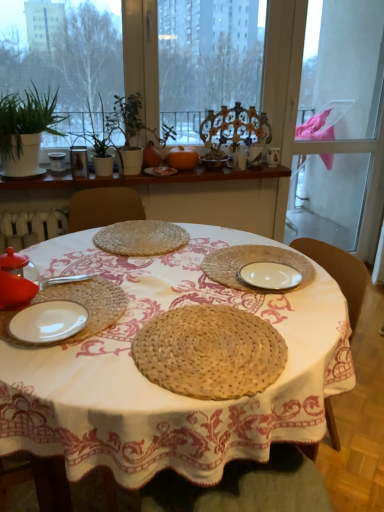
Locate an element on the screen. This screenshot has width=384, height=512. free space in front of woven straw placemat at center, which is the 4th plate in bottom-to-top order is located at coordinates (127, 276).